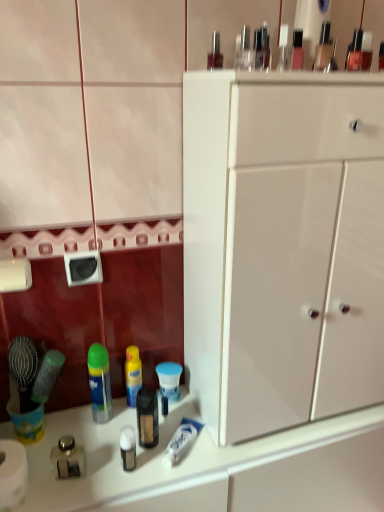
The image size is (384, 512). What are the coordinates of `vacant space that is to the left of clear glass jar at lower left, the first toiletry positioned from the front` in the screenshot? It's located at (41, 463).